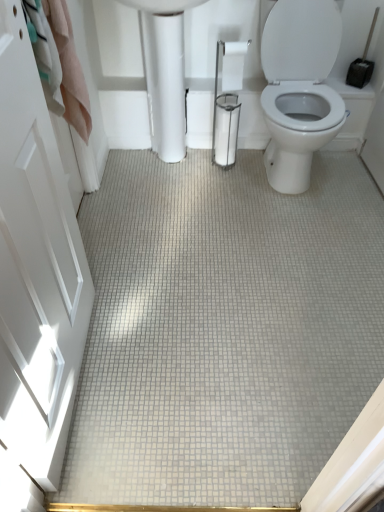
What are the coordinates of `white glossy toilet paper at center` in the screenshot? It's located at (233, 65).

This screenshot has width=384, height=512. Describe the element at coordinates (36, 268) in the screenshot. I see `white glossy door at left` at that location.

Image resolution: width=384 pixels, height=512 pixels. I want to click on white glossy door at left, so click(36, 268).

Describe the element at coordinates (165, 72) in the screenshot. I see `white glossy porcelain at center` at that location.

Locate an element on the screen. The width and height of the screenshot is (384, 512). white glossy toilet paper at center is located at coordinates (233, 65).

Which object is positioned more to the left, white glossy door at left or white glossy toilet paper at center?

white glossy door at left is more to the left.

Is white glossy toilet paper at center at the back of white glossy door at left?

No.

Is white glossy door at left outside of white glossy toilet paper at center?

Indeed, white glossy door at left is completely outside white glossy toilet paper at center.

Is white glossy porcelain at center inside white glossy door at left?

No, white glossy door at left does not contain white glossy porcelain at center.

In order to click on screen door in front of the white glossy porcelain at center in this screenshot , I will do `click(36, 268)`.

Is white glossy door at left wider or thinner than white glossy porcelain at center?

In the image, white glossy door at left appears to be more narrow than white glossy porcelain at center.

From a real-world perspective, is white glossy door at left positioned above or below white glossy porcelain at center?

A: From a real-world perspective, white glossy door at left is physically above white glossy porcelain at center.

Find the location of a particular element. This screenshot has height=512, width=384. toilet paper above the white glossy porcelain at center (from the image's perspective) is located at coordinates (233, 65).

Can you tell me how much white glossy toilet paper at center and white glossy porcelain at center differ in facing direction?

The angle between the facing direction of white glossy toilet paper at center and the facing direction of white glossy porcelain at center is 0.284 degrees.

Considering the relative positions of white glossy toilet paper at center and white glossy porcelain at center in the image provided, is white glossy toilet paper at center to the left or to the right of white glossy porcelain at center?

Based on their positions, white glossy toilet paper at center is located to the right of white glossy porcelain at center.

Would you say white glossy toilet paper at center contains white glossy porcelain at center?

No, white glossy porcelain at center is located outside of white glossy toilet paper at center.

How different are the orientations of white glossy porcelain at center and white glossy door at left in degrees?

91.6 degrees.

Between point (156, 150) and point (53, 162), which one is positioned behind?

Positioned behind is point (156, 150).

Is white glossy porcelain at center turned away from white glossy door at left?

That's not correct — white glossy porcelain at center is not looking away from white glossy door at left.

Is white glossy porcelain at center bigger than white glossy toilet paper at center?

Correct, white glossy porcelain at center is larger in size than white glossy toilet paper at center.

Is white glossy porcelain at center far from white glossy toilet paper at center?

No.

Is white glossy toilet paper at center surrounded by white glossy porcelain at center?

Yes, white glossy toilet paper at center is surrounded by white glossy porcelain at center.

Measure the distance from white glossy porcelain at center to white glossy toilet paper at center.

A distance of 12.13 inches exists between white glossy porcelain at center and white glossy toilet paper at center.

Looking at their sizes, would you say white glossy toilet paper at center is wider or thinner than white glossy door at left?

In the image, white glossy toilet paper at center appears to be wider than white glossy door at left.

Is white glossy toilet paper at center oriented away from white glossy door at left?

No.

From the image's perspective, relative to white glossy door at left, is white glossy toilet paper at center above or below?

white glossy toilet paper at center is above white glossy door at left.

From a real-world perspective, is white glossy toilet paper at center physically below white glossy door at left?

Yes.

I want to click on toilet paper on the right of white glossy door at left, so [x=233, y=65].

Locate an element on the screen. Image resolution: width=384 pixels, height=512 pixels. porcelain above the white glossy door at left (from the image's perspective) is located at coordinates (165, 72).

Looking at the image, which one is located closer to white glossy door at left, white glossy toilet paper at center or white glossy porcelain at center?

white glossy porcelain at center is closer to white glossy door at left.

From the picture: When comparing their distances from white glossy door at left, does white glossy porcelain at center or white glossy toilet paper at center seem closer?

The object closer to white glossy door at left is white glossy porcelain at center.

Considering their positions, is white glossy door at left positioned closer to white glossy porcelain at center than white glossy toilet paper at center?

white glossy toilet paper at center.

Estimate the real-world distances between objects in this image. Which object is further from white glossy toilet paper at center, white glossy porcelain at center or white glossy door at left?

white glossy door at left is positioned further to the anchor white glossy toilet paper at center.

From the image, which object appears to be nearer to white glossy porcelain at center, white glossy toilet paper at center or white glossy door at left?

white glossy toilet paper at center lies closer to white glossy porcelain at center than the other object.

Based on their spatial positions, is white glossy door at left or white glossy porcelain at center closer to white glossy toilet paper at center?

Based on the image, white glossy porcelain at center appears to be nearer to white glossy toilet paper at center.

Where is `porcelain located between white glossy door at left and white glossy toilet paper at center in the depth direction`? porcelain located between white glossy door at left and white glossy toilet paper at center in the depth direction is located at coordinates (165, 72).